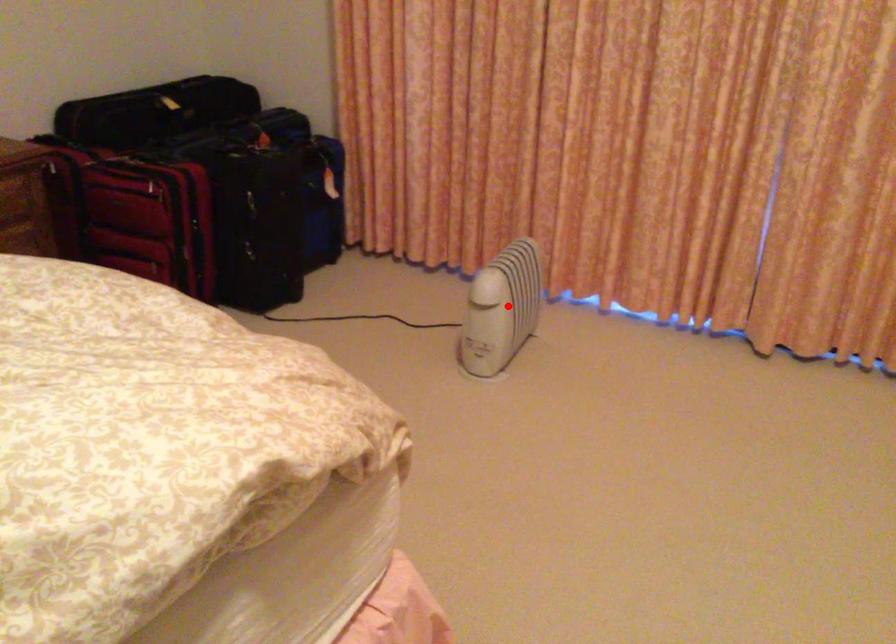
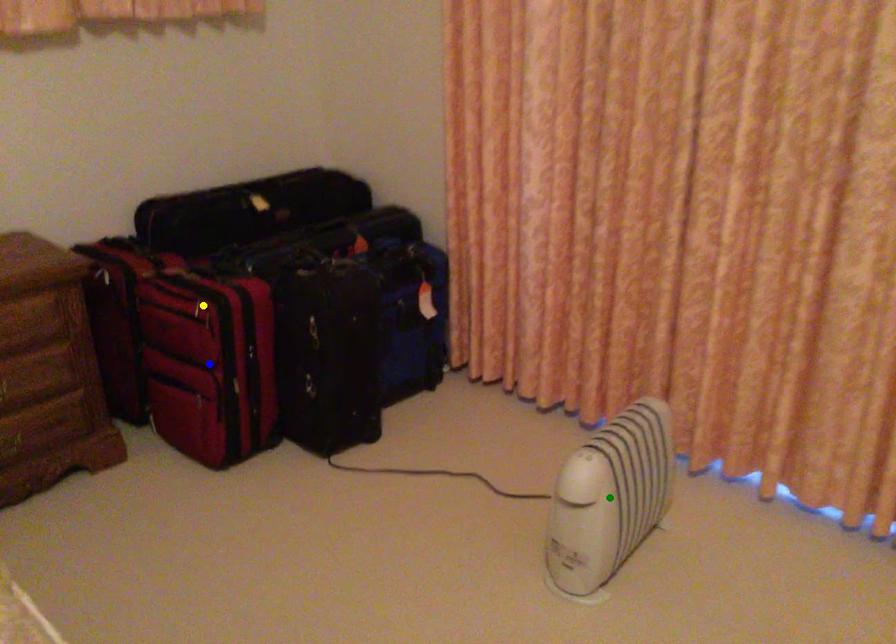
Question: I am providing you with two images of the same scene from different viewpoints. A red point is marked on the first image. You are given multiple points on the second image. Which spot in image 2 lines up with the point in image 1?

Choices:
 (A) green point
 (B) blue point
 (C) yellow point

Answer: (A)